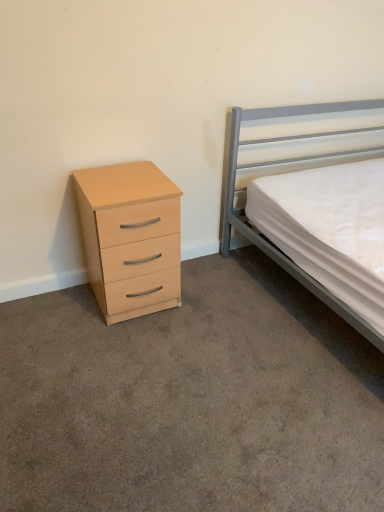
You are a GUI agent. You are given a task and a screenshot of the screen. Output one action in this format:
    pyautogui.click(x=<x>, y=<y>)
    Task: Click on the free space to the left of matte wood chest of drawers at left
    Image resolution: width=384 pixels, height=512 pixels.
    Given the screenshot: What is the action you would take?
    pyautogui.click(x=56, y=312)